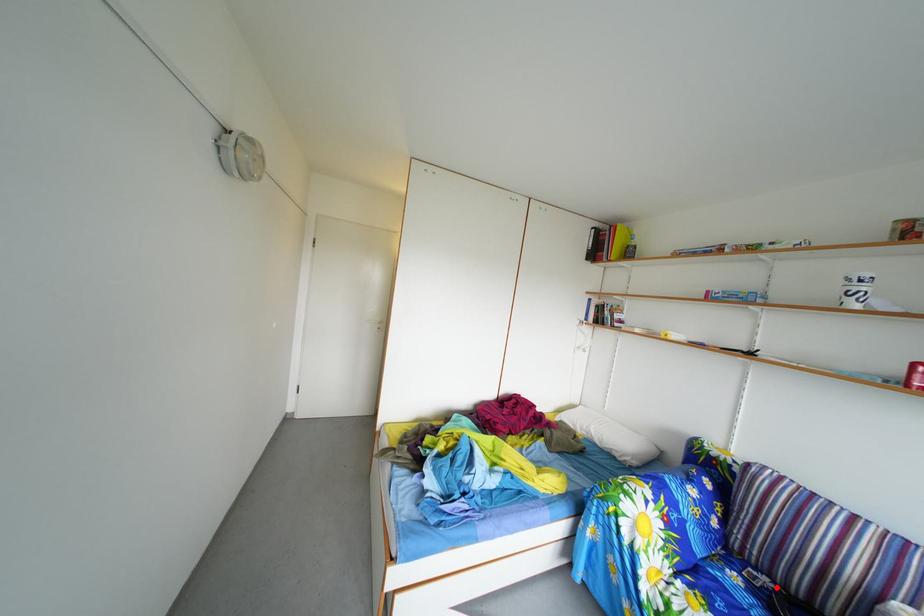
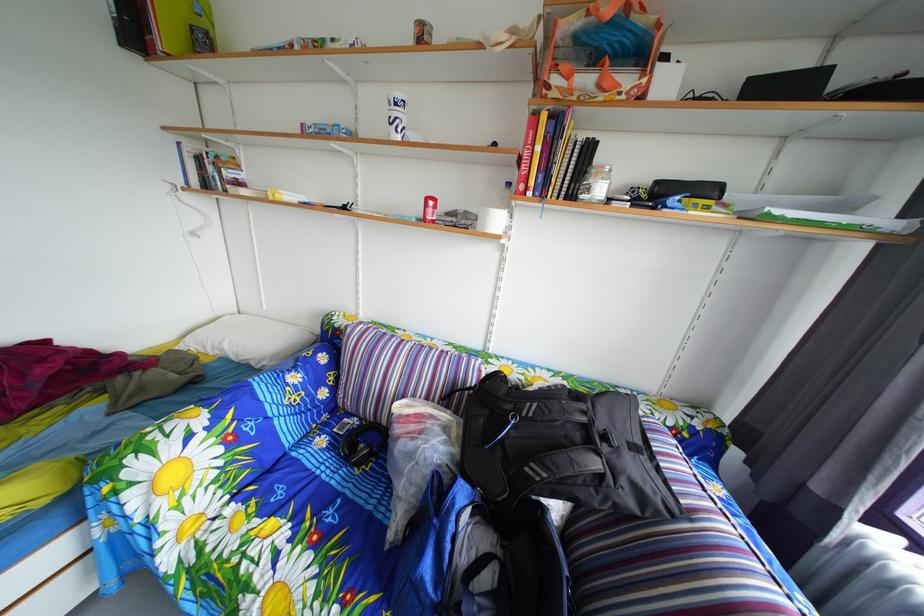
Question: I am providing you with two images of the same scene from different viewpoints. Image1 has a red point marked. In image2, the corresponding 3D location appears at what relative position? Reply with the corresponding letter.

Choices:
 (A) Closer
 (B) Farther

Answer: (B)